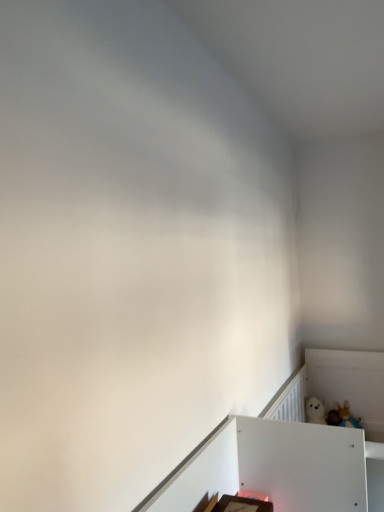
Question: From the image's perspective, is white matte bed frame at upper right above or below white plush bear at lower right?

Choices:
 (A) above
 (B) below

Answer: (B)

Question: In terms of width, does white matte bed frame at upper right look wider or thinner when compared to white plush bear at lower right?

Choices:
 (A) thin
 (B) wide

Answer: (B)

Question: Is point (365, 396) closer or farther from the camera than point (354, 423)?

Choices:
 (A) closer
 (B) farther

Answer: (B)

Question: From the image's perspective, is white plush bear at lower right above or below white matte bed frame at upper right?

Choices:
 (A) below
 (B) above

Answer: (B)

Question: Is white plush bear at lower right in front of or behind white matte bed frame at upper right in the image?

Choices:
 (A) behind
 (B) front

Answer: (A)

Question: From their relative heights in the image, would you say white plush bear at lower right is taller or shorter than white matte bed frame at upper right?

Choices:
 (A) short
 (B) tall

Answer: (A)

Question: Would you say white plush bear at lower right is to the left or to the right of white matte bed frame at upper right in the picture?

Choices:
 (A) left
 (B) right

Answer: (B)